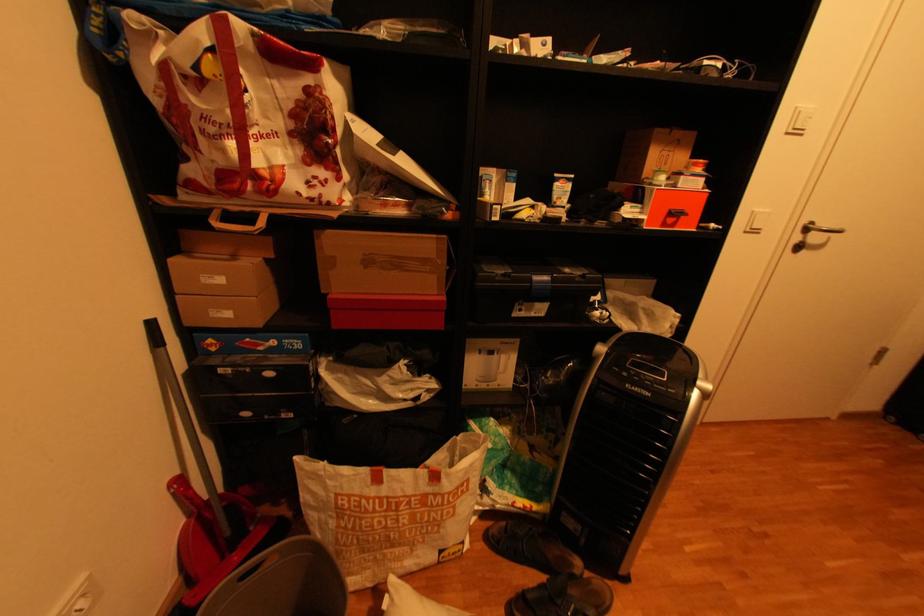
Describe the element at coordinates (696, 164) in the screenshot. The width and height of the screenshot is (924, 616). I see `a small orange-capped bottle` at that location.